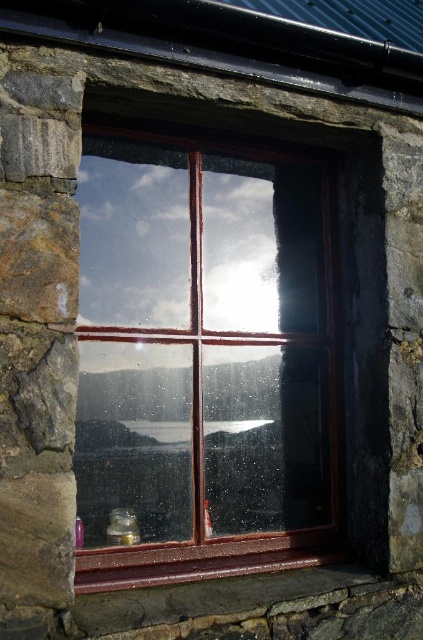
You are standing in a room with an old window. You need to place a small decoration exactly at the point marked as point (x=203, y=358). Where should you place it according to the wooden window at center?

The point (x=203, y=358) is located on the wooden window at center, so you should place the decoration directly on the wooden window at center.

You are standing in a room with an old rustic style. You need to clean the wooden window at center. If your cleaning tool can reach up to 8 feet, can you clean it without moving closer?

The wooden window at center is 8.23 feet away from the camera. Since your tool can only reach up to 8 feet, you cannot clean it without moving closer.